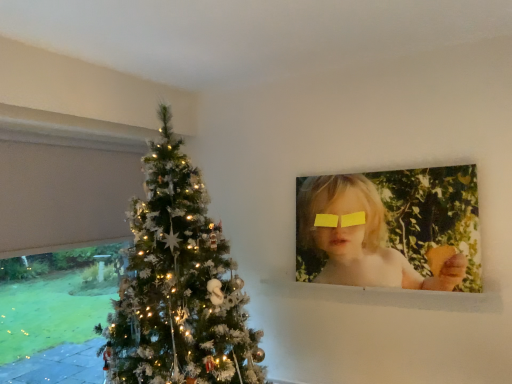
Question: Considering the relative positions of matte yellow paper at upper right and yellow matte glasses at upper center in the image provided, is matte yellow paper at upper right to the right of yellow matte glasses at upper center from the viewer's perspective?

Choices:
 (A) no
 (B) yes

Answer: (B)

Question: Is matte yellow paper at upper right closer to camera compared to yellow matte glasses at upper center?

Choices:
 (A) yes
 (B) no

Answer: (A)

Question: Is yellow matte glasses at upper center inside matte yellow paper at upper right?

Choices:
 (A) no
 (B) yes

Answer: (B)

Question: Is matte yellow paper at upper right completely or partially outside of yellow matte glasses at upper center?

Choices:
 (A) yes
 (B) no

Answer: (A)

Question: Is matte yellow paper at upper right shorter than yellow matte glasses at upper center?

Choices:
 (A) yes
 (B) no

Answer: (B)

Question: Can you confirm if matte yellow paper at upper right is smaller than yellow matte glasses at upper center?

Choices:
 (A) yes
 (B) no

Answer: (B)

Question: Is yellow matte glasses at upper center to the left of matte yellow paper at upper right from the viewer's perspective?

Choices:
 (A) no
 (B) yes

Answer: (B)

Question: Would you say matte yellow paper at upper right is part of yellow matte glasses at upper center's contents?

Choices:
 (A) yes
 (B) no

Answer: (B)

Question: Can you confirm if yellow matte glasses at upper center is taller than matte yellow paper at upper right?

Choices:
 (A) no
 (B) yes

Answer: (A)

Question: From the image's perspective, is yellow matte glasses at upper center above matte yellow paper at upper right?

Choices:
 (A) no
 (B) yes

Answer: (B)

Question: Is yellow matte glasses at upper center at the right side of matte yellow paper at upper right?

Choices:
 (A) no
 (B) yes

Answer: (A)

Question: Are yellow matte glasses at upper center and matte yellow paper at upper right beside each other?

Choices:
 (A) yes
 (B) no

Answer: (B)

Question: Is matte yellow paper at upper right in front of or behind yellow matte glasses at upper center in the image?

Choices:
 (A) front
 (B) behind

Answer: (A)